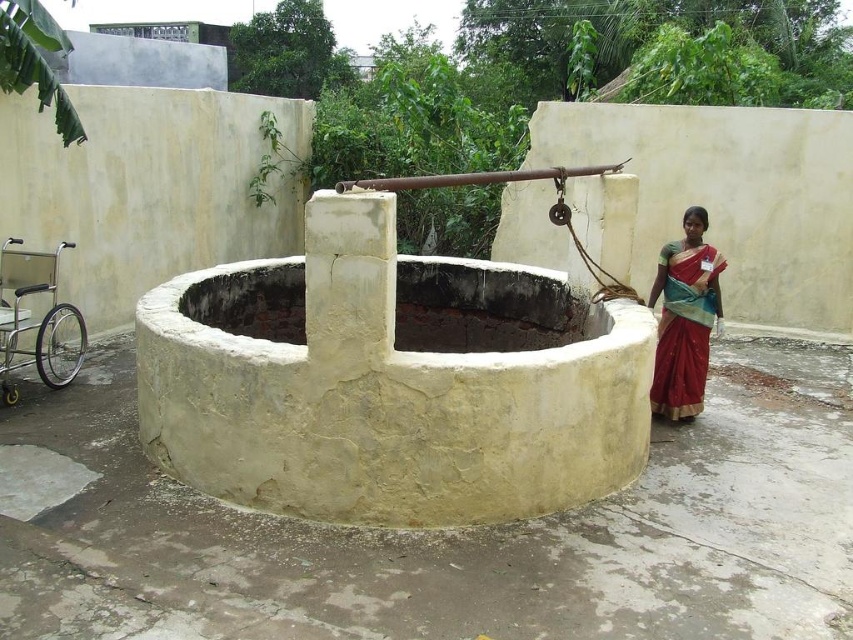
Consider the image. You are standing in front of the well and want to place two markers at the coordinates point [581,616] and point [675,324]. Which marker will be closer to you?

Point [581,616] is closer to the viewer than point [675,324], so the marker at point [581,616] will be closer to you.

You are a visitor at the well and see the red silk sari at right and the silver metallic wheelchair at lower left. Which object is covering the other?

The red silk sari at right is positioned over the silver metallic wheelchair at lower left, so it is covering the wheelchair.

You are standing at the center of the image. Where is the smooth concrete well at center located in relation to your position?

The smooth concrete well at center is located exactly at your current position since you are standing at the center of the image.